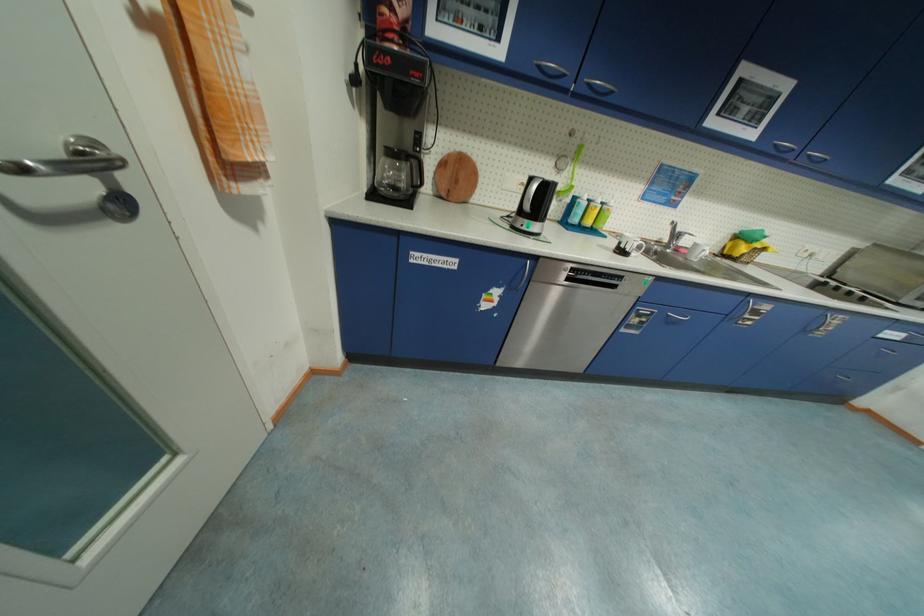
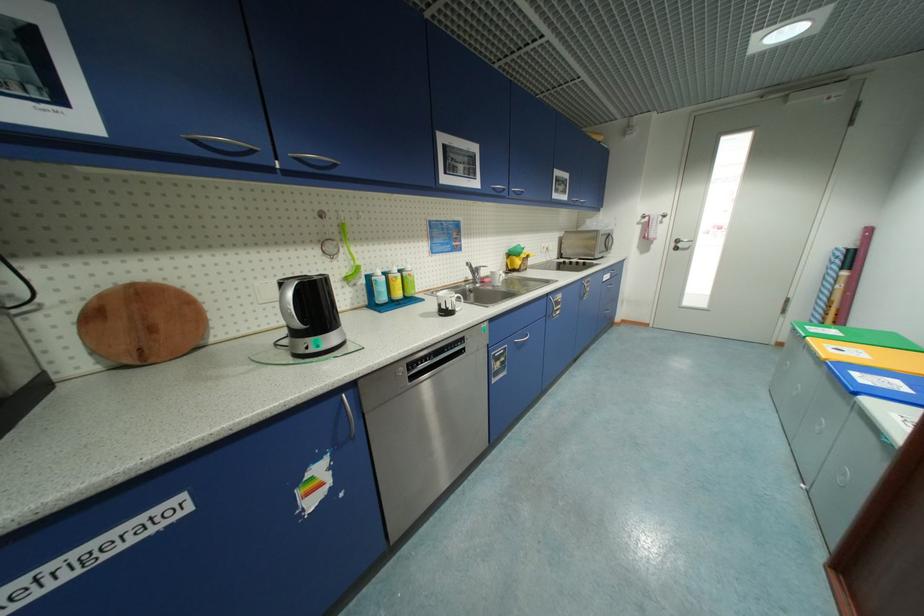
Find the pixel in the second image that matches point (584, 201) in the first image.

(380, 280)